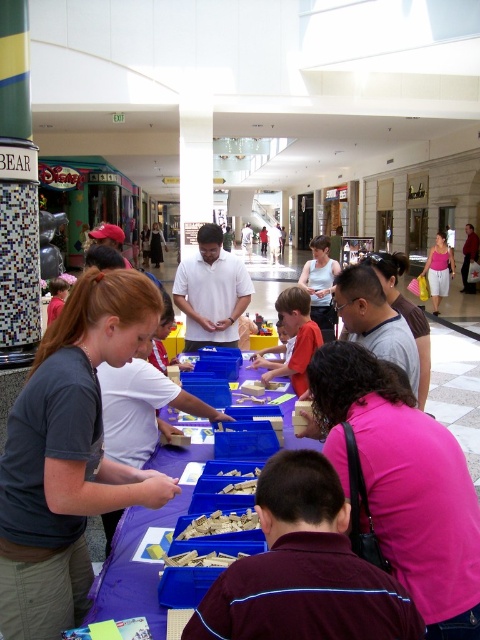
Which is in front, point (240, 508) or point (228, 486)?

Point (240, 508) is in front.

Can you confirm if crumbly yellow cake at center is smaller than smooth plastic toy at center?

No.

At what (x,y) coordinates should I click in order to perform the action: click on crumbly yellow cake at center. Please return your answer as a coordinate pair (x, y). Looking at the image, I should click on (218, 525).

Can you confirm if purple plastic table at center is positioned above smooth plastic toy at center?

Incorrect, purple plastic table at center is not positioned above smooth plastic toy at center.

Does purple plastic table at center appear under smooth plastic toy at center?

Correct, purple plastic table at center is located below smooth plastic toy at center.

Is point (288, 403) positioned in front of point (238, 472)?

No, it is behind (238, 472).

You are a GUI agent. You are given a task and a screenshot of the screen. Output one action in this format:
    pyautogui.click(x=<x>, y=<y>)
    Task: Click on the purple plastic table at center
    The image size is (480, 640).
    Given the screenshot: What is the action you would take?
    tap(133, 568)

Does light brown wooden toy at center lie in front of smooth plastic toy at center?

No, it is behind smooth plastic toy at center.

Where is `light brown wooden toy at center`? light brown wooden toy at center is located at coordinates (296, 337).

Is point (286, 320) positioned in front of point (220, 476)?

No.

This screenshot has height=640, width=480. Identify the location of light brown wooden toy at center. (296, 337).